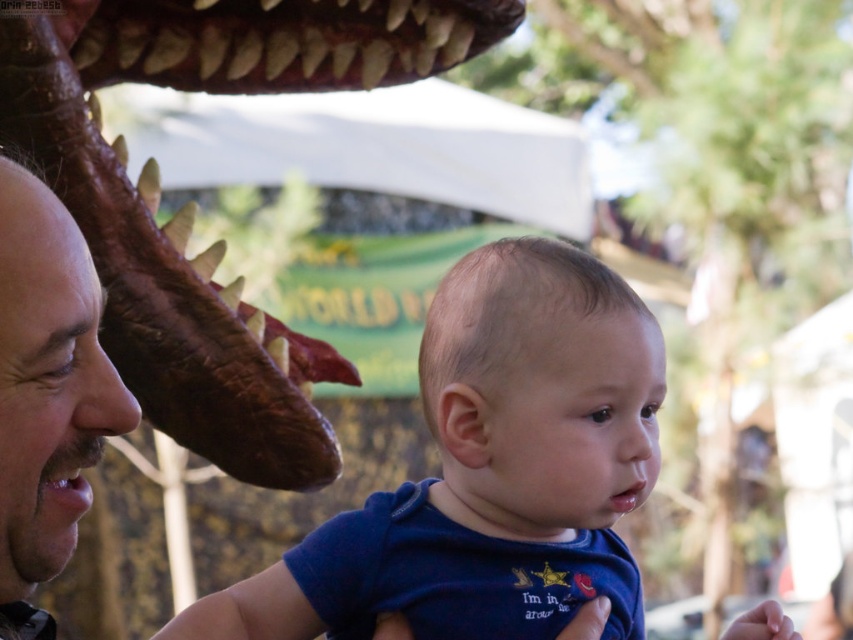
Can you confirm if blue cotton shirt at center is positioned to the right of smooth brown leather face at left?

Yes, blue cotton shirt at center is to the right of smooth brown leather face at left.

Between blue cotton shirt at center and smooth brown leather face at left, which one is positioned lower?

blue cotton shirt at center

This screenshot has height=640, width=853. I want to click on blue cotton shirt at center, so click(485, 449).

Where is `blue cotton shirt at center`? The width and height of the screenshot is (853, 640). blue cotton shirt at center is located at coordinates (485, 449).

Is blue cotton shirt at center shorter than brown textured head at upper left?

Indeed, blue cotton shirt at center has a lesser height compared to brown textured head at upper left.

Between point (566, 337) and point (190, 42), which one is positioned in front?

Point (566, 337) is more forward.

I want to click on blue cotton shirt at center, so click(485, 449).

In the scene shown: Can you confirm if brown textured head at upper left is positioned below smooth brown leather face at left?

No, brown textured head at upper left is not below smooth brown leather face at left.

Who is more distant from viewer, (260,435) or (18,301)?

The point (260,435) is behind.

Locate an element on the screen. The image size is (853, 640). brown textured head at upper left is located at coordinates (170, 240).